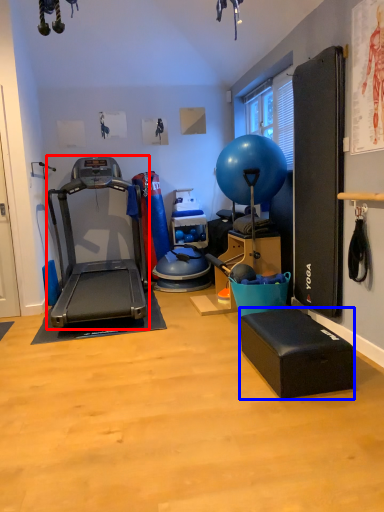
Question: Which object is further to the camera taking this photo, treadmill (highlighted by a red box) or footrest (highlighted by a blue box)?

Choices:
 (A) treadmill
 (B) footrest

Answer: (A)